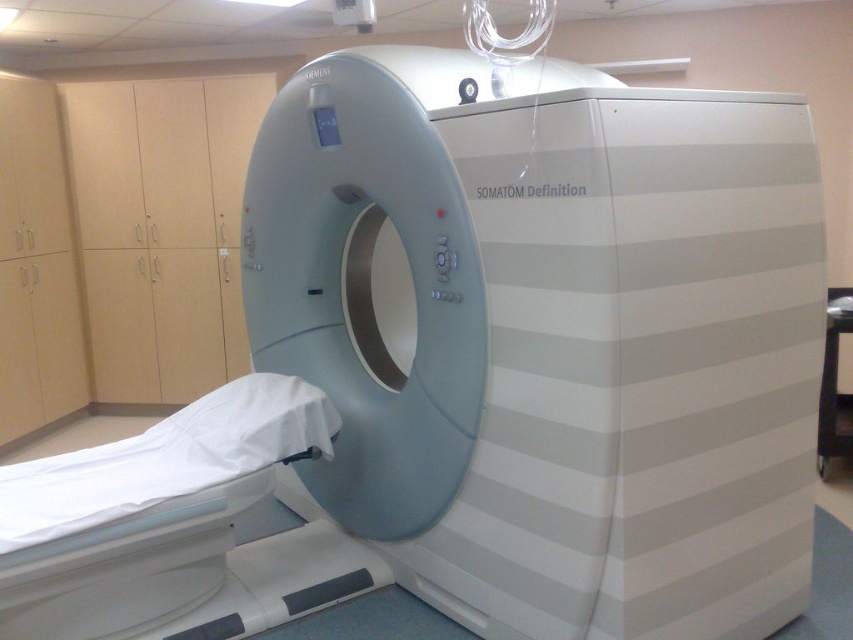
Is point (814, 320) positioned after point (125, 442)?

No, (814, 320) is in front of (125, 442).

The height and width of the screenshot is (640, 853). Find the location of `white glossy mri scanner at center`. white glossy mri scanner at center is located at coordinates (550, 336).

Identify the location of white glossy mri scanner at center. (550, 336).